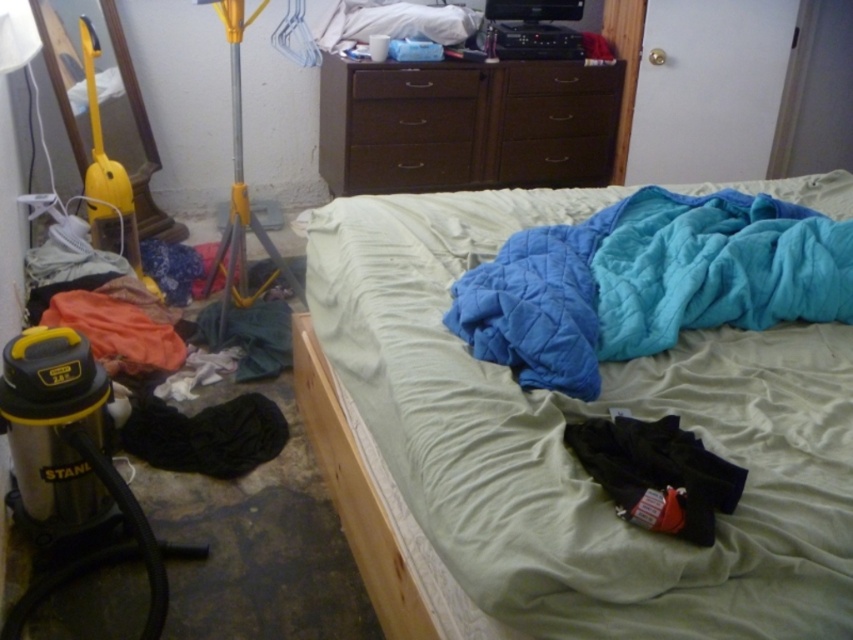
You are trying to make the bed. You have the quilted fabric bed at center and the quilted blue blanket at center. Which item should you place on top to cover the bed properly?

The quilted blue blanket at center should be placed on top because the quilted fabric bed at center is below it, indicating it forms the base while the blue blanket is the upper layer.

You are standing at the point labeled point (387, 104) and want to move to the door located at point (683, 557). Is the path clear between these two points?

The path between point (387, 104) and point (683, 557) is clear because point (683, 557) is in front of point (387, 104), indicating no obstructions are blocking the direct line between them.

You are standing at point [453,154] and want to walk to the bed with a light green sheet and blue quilt. Is there a clear path from your current position to the bed without passing through point [546,348]?

Point [546,348] is in front of point [453,154]. Since you are at point [453,154] and want to go to the bed, you would have to pass through point [546,348] which is in front of you. Therefore, there is no clear path to the bed without passing through point [546,348].